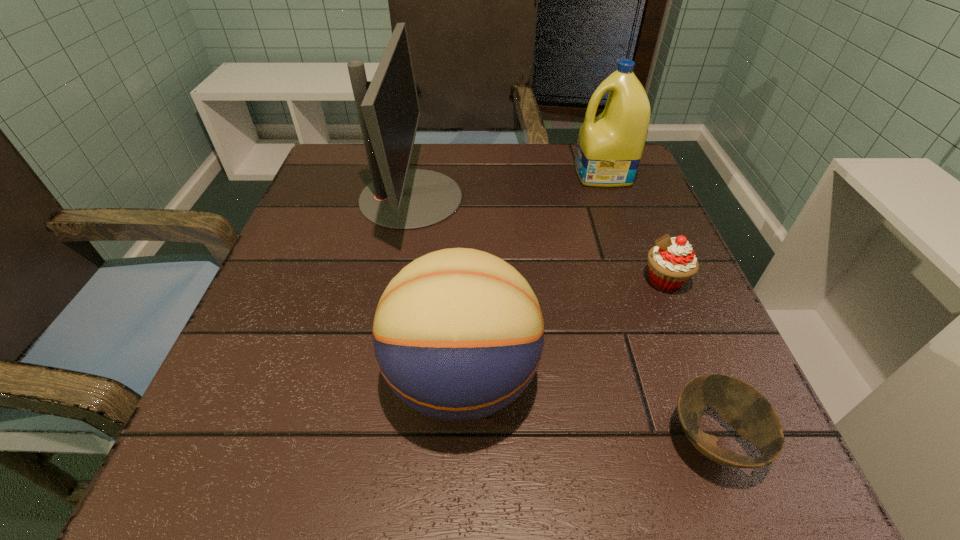
Find the location of a particular element. The image size is (960, 540). vacant space that satisfies the following two spatial constraints: 1. on the label of the detergent; 2. on the back side of the shortest object is located at coordinates pos(700,439).

Locate an element on the screen. blank space that satisfies the following two spatial constraints: 1. on the patterned surface of the bowl; 2. on the left side of the basketball is located at coordinates click(x=460, y=439).

Locate an element on the screen. The width and height of the screenshot is (960, 540). vacant space that satisfies the following two spatial constraints: 1. on the screen of the tallest object; 2. on the back side of the bowl is located at coordinates (365, 439).

Where is `vacant point that satisfies the following two spatial constraints: 1. on the back side of the cupcake; 2. on the screen of the tallest object`? vacant point that satisfies the following two spatial constraints: 1. on the back side of the cupcake; 2. on the screen of the tallest object is located at coordinates (630, 198).

This screenshot has width=960, height=540. I want to click on free location that satisfies the following two spatial constraints: 1. on the patterned surface of the basketball; 2. on the left side of the shortest object, so click(460, 439).

In order to click on vacant area that satisfies the following two spatial constraints: 1. on the patterned surface of the shortest object; 2. on the right side of the basketball in this screenshot , I will do `click(460, 439)`.

I want to click on free location that satisfies the following two spatial constraints: 1. on the patterned surface of the basketball; 2. on the back side of the bowl, so click(460, 439).

At what (x,y) coordinates should I click in order to perform the action: click on vacant area that satisfies the following two spatial constraints: 1. on the patterned surface of the basketball; 2. on the back side of the bowl. Please return your answer as a coordinate pair (x, y). This screenshot has height=540, width=960. Looking at the image, I should click on (460, 439).

Identify the location of free point that satisfies the following two spatial constraints: 1. on the back side of the second shortest object; 2. on the label of the detergent. (620, 174).